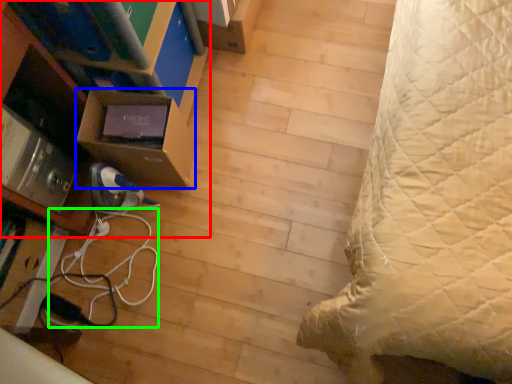
Question: Which object is the farthest from furniture (highlighted by a red box)? Choose among these: shelf (highlighted by a blue box) or cable (highlighted by a green box).

Choices:
 (A) shelf
 (B) cable

Answer: (B)